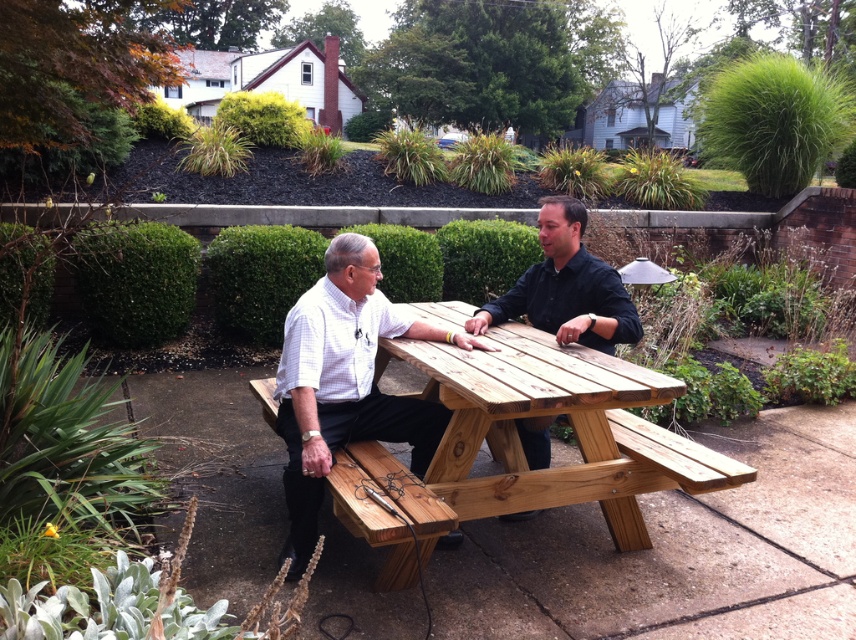
You are a person who is 1.8 meters tall. You want to sit at the light brown wood picnic table at center and the wooden picnic table at center. Which table would be more comfortable for you to sit at, considering your height?

The light brown wood picnic table at center has a greater height compared to wooden picnic table at center, so it would be more comfortable for someone who is 1.8 meters tall to sit at the light brown wood picnic table at center since it has a higher seat height.

You are planning to place a 1.5 meter long rectangular box on the light brown wood picnic table at center. The natural wood park bench at center is located next to the picnic table. Can the box fit on the picnic table without overhanging the edges?

The light brown wood picnic table at center might be wider than natural wood park bench at center, but since the box is 1.5 meters long, we cannot determine if it will fit without knowing the exact width of the picnic table.

You are standing at the origin point of the coordinate system where the picnic table is located. The picnic table is at point (343, 384). If you want to move towards the brick wall that is behind the picnic table, which direction should you move in relation to the picnic table?

The brick wall is behind the picnic table at point (343, 384). Since the brick wall is behind the picnic table, you should move in the direction away from the brick wall, which would be the opposite direction of the wall relative to the picnic table.